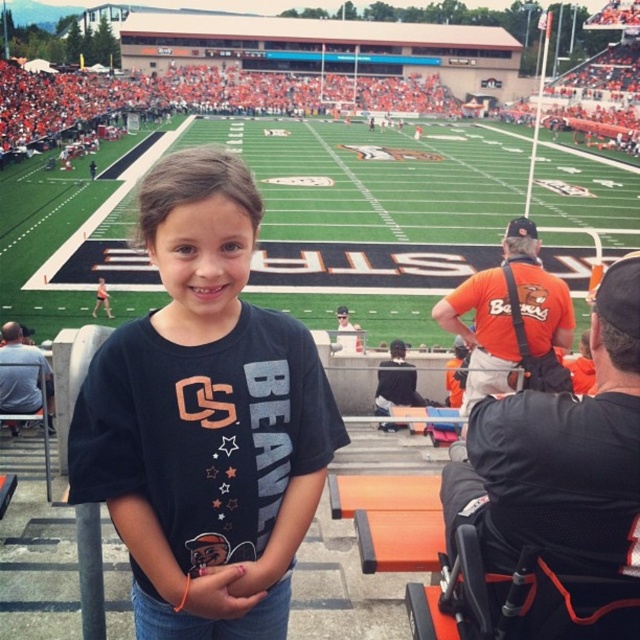
Is black matte shirt at center above orange fabric wheelchair at lower right?

Correct, black matte shirt at center is located above orange fabric wheelchair at lower right.

Does black matte shirt at center have a lesser width compared to orange fabric wheelchair at lower right?

No.

Who is more distant from viewer, (x=348, y=436) or (x=464, y=518)?

The point (x=348, y=436) is behind.

Where is `black matte shirt at center`? The height and width of the screenshot is (640, 640). black matte shirt at center is located at coordinates (204, 419).

Can you confirm if black matte shirt at center is positioned above green turf football field at center?

No.

Does point (144, 179) come farther from viewer compared to point (365, 202)?

No.

Who is more forward, (100, 355) or (420, 163)?

Point (100, 355)

Where is `black matte shirt at center`? black matte shirt at center is located at coordinates (204, 419).

Is green turf football field at center to the left of orange fabric wheelchair at lower right from the viewer's perspective?

Yes, green turf football field at center is to the left of orange fabric wheelchair at lower right.

Is point (556, 202) more distant than point (483, 637)?

Yes, point (556, 202) is farther from viewer.

Identify the location of green turf football field at center. (376, 211).